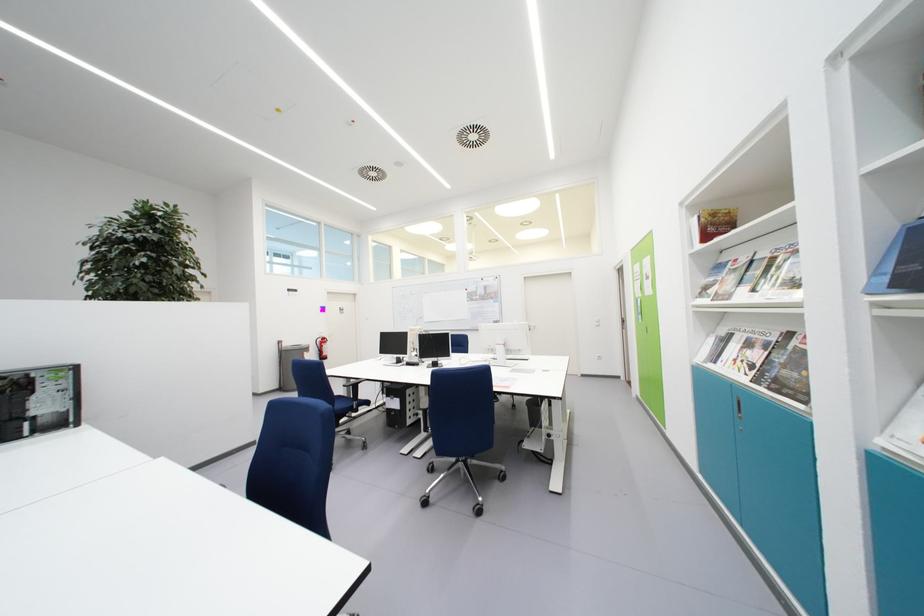
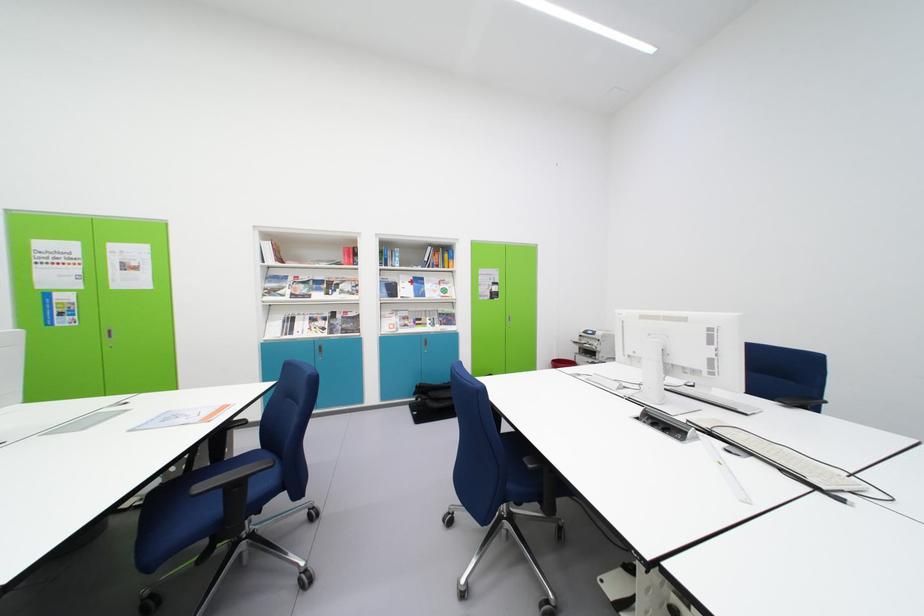
In the second image, find the point that corresponds to (718,284) in the first image.

(281, 289)